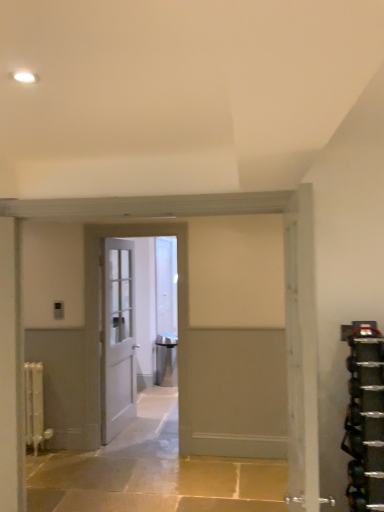
Question: In terms of height, does white painted wood door at center, the first door viewed from the front, look taller or shorter compared to white glossy door at center, which is the 1th door in back-to-front order?

Choices:
 (A) tall
 (B) short

Answer: (A)

Question: From a real-world perspective, is white painted wood door at center, the first door viewed from the front, physically located above or below white glossy door at center, which is counted as the 3th door, starting from the left?

Choices:
 (A) below
 (B) above

Answer: (A)

Question: Which object is the farthest from the white wooden door at center, which ranks as the third door in right-to-left order?

Choices:
 (A) white matte radiator at left
 (B) metallic silver weights at right
 (C) white painted wood door at center, acting as the 4th door starting from the left
 (D) white wooden door at center, acting as the 3th door starting from the front
 (E) white glossy door at center, which is the 2th door in right-to-left order

Answer: (B)

Question: Which is nearer to the metallic silver weights at right?

Choices:
 (A) white wooden door at center, the third door when ordered from back to front
 (B) white matte radiator at left
 (C) white glossy door at center, which is counted as the 3th door, starting from the left
 (D) white wooden door at center, which ranks as the fourth door in right-to-left order
 (E) satin silver trash can at center

Answer: (A)